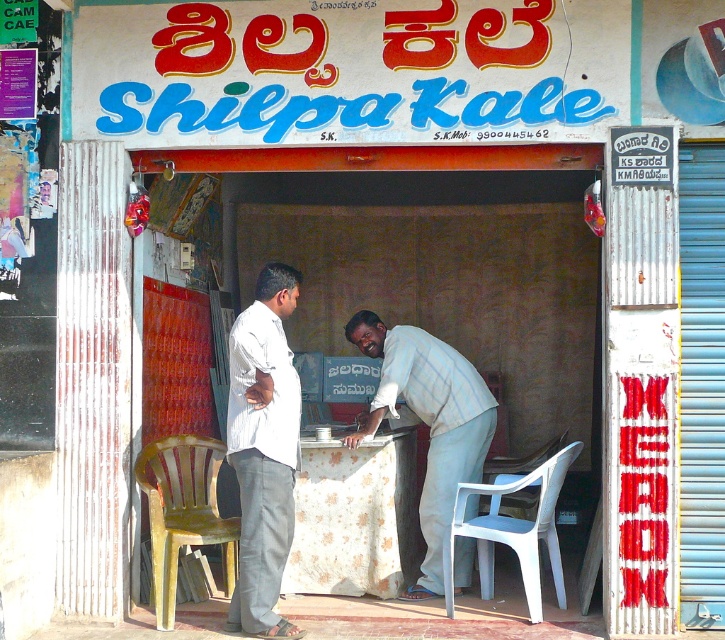
Question: Is yellow plastic chair at lower left wider than white plastic chair at lower right?

Choices:
 (A) no
 (B) yes

Answer: (A)

Question: Is white cotton shirt at center positioned at the back of floral fabric tablecloth at center?

Choices:
 (A) yes
 (B) no

Answer: (B)

Question: Which point is farther to the camera?

Choices:
 (A) floral fabric tablecloth at center
 (B) light blue fabric shirt at center
 (C) white cotton shirt at center

Answer: (A)

Question: Estimate the real-world distances between objects in this image. Which object is farther from the yellow plastic chair at lower left?

Choices:
 (A) white plastic chair at lower right
 (B) white cotton shirt at center
 (C) light blue fabric shirt at center

Answer: (A)

Question: Which point is farther from the camera taking this photo?

Choices:
 (A) (360, 554)
 (B) (236, 474)
 (C) (579, 448)
 (D) (473, 403)

Answer: (D)

Question: Is white cotton shirt at center to the right of white plastic chair at lower right from the viewer's perspective?

Choices:
 (A) no
 (B) yes

Answer: (A)